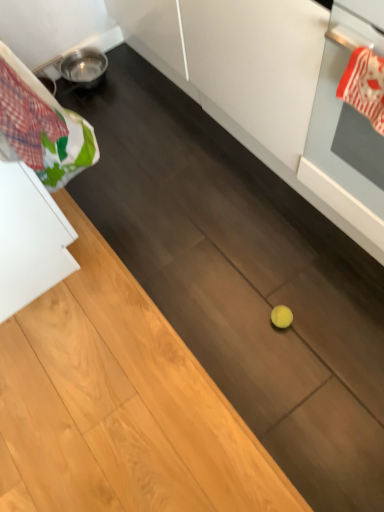
Question: Can you confirm if plaid fabric laundry at upper left is smaller than red and white striped oven mitt at upper right?

Choices:
 (A) yes
 (B) no

Answer: (B)

Question: From a real-world perspective, is plaid fabric laundry at upper left over red and white striped oven mitt at upper right?

Choices:
 (A) no
 (B) yes

Answer: (B)

Question: Is plaid fabric laundry at upper left oriented away from red and white striped oven mitt at upper right?

Choices:
 (A) no
 (B) yes

Answer: (A)

Question: Is plaid fabric laundry at upper left at the left side of red and white striped oven mitt at upper right?

Choices:
 (A) no
 (B) yes

Answer: (B)

Question: Would you consider plaid fabric laundry at upper left to be distant from red and white striped oven mitt at upper right?

Choices:
 (A) yes
 (B) no

Answer: (B)

Question: Is plaid fabric laundry at upper left further to camera compared to red and white striped oven mitt at upper right?

Choices:
 (A) yes
 (B) no

Answer: (B)

Question: Is red and white striped oven mitt at upper right oriented towards white glossy oven at right?

Choices:
 (A) no
 (B) yes

Answer: (B)

Question: Is red and white striped oven mitt at upper right touching white glossy oven at right?

Choices:
 (A) no
 (B) yes

Answer: (A)

Question: From a real-world perspective, is red and white striped oven mitt at upper right positioned under white glossy oven at right based on gravity?

Choices:
 (A) yes
 (B) no

Answer: (B)

Question: Is red and white striped oven mitt at upper right in front of white glossy oven at right?

Choices:
 (A) yes
 (B) no

Answer: (B)

Question: Is red and white striped oven mitt at upper right at the left side of white glossy oven at right?

Choices:
 (A) no
 (B) yes

Answer: (B)

Question: Is red and white striped oven mitt at upper right wider than white glossy oven at right?

Choices:
 (A) yes
 (B) no

Answer: (B)

Question: From the image's perspective, is white glossy oven at right over plaid fabric laundry at upper left?

Choices:
 (A) yes
 (B) no

Answer: (B)